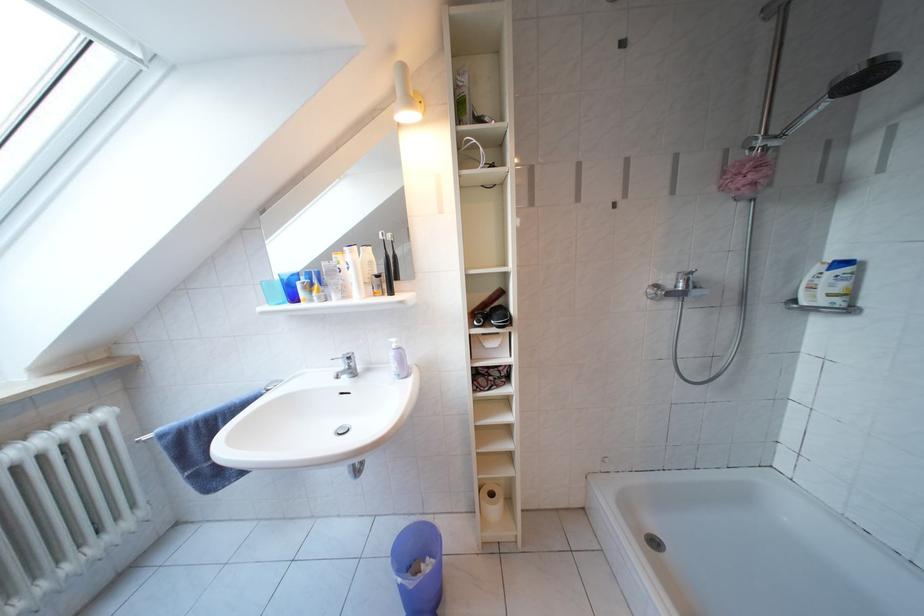
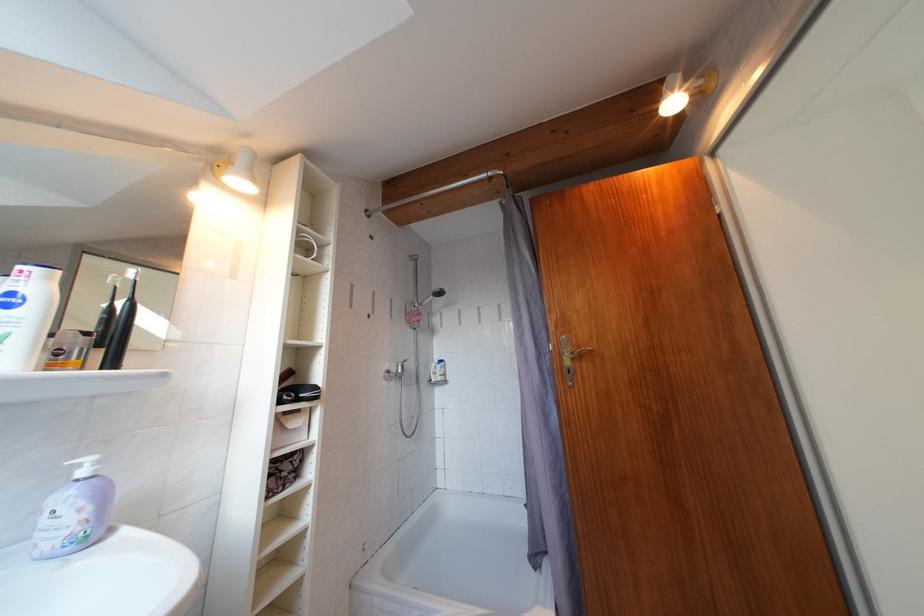
Locate, in the second image, the point that corresponds to point 723,193 in the first image.

(411, 325)